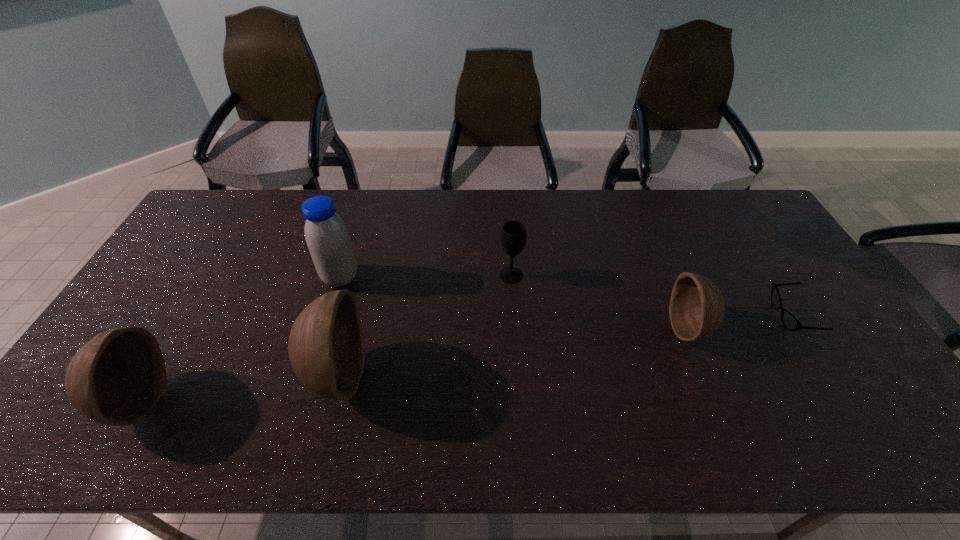
At what (x,y) coordinates should I click in order to perform the action: click on vacant region at the far edge of the desktop. Please return your answer as a coordinate pair (x, y). Image resolution: width=960 pixels, height=540 pixels. Looking at the image, I should click on (686, 189).

In the image, there is a desktop. Identify the location of vacant region at the left edge. Image resolution: width=960 pixels, height=540 pixels. (196, 238).

This screenshot has width=960, height=540. In order to click on free space at the right edge in this screenshot , I will do `click(835, 353)`.

This screenshot has width=960, height=540. Find the location of `vacant area at the far right corner`. vacant area at the far right corner is located at coordinates (721, 206).

Find the location of a particular element. free point between the second bowl from right to left and the shortest object is located at coordinates (564, 345).

Where is `vacant area between the rightmost bowl and the soya milk`? This screenshot has width=960, height=540. vacant area between the rightmost bowl and the soya milk is located at coordinates (515, 303).

I want to click on vacant space that is in between the fourth object from left to right and the soya milk, so click(x=425, y=276).

Locate an element on the screen. Image resolution: width=960 pixels, height=540 pixels. free spot between the spectacles and the third object from right to left is located at coordinates [x=651, y=295].

Where is `free spot between the shortest bowl and the shortest object`? This screenshot has height=540, width=960. free spot between the shortest bowl and the shortest object is located at coordinates (739, 323).

Identify the location of empty location between the soya milk and the fourth shortest object. (239, 339).